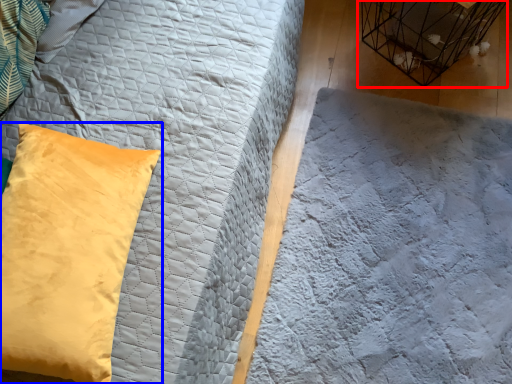
Question: Which of the following is the farthest to the observer, bird cage (highlighted by a red box) or pillow (highlighted by a blue box)?

Choices:
 (A) bird cage
 (B) pillow

Answer: (A)